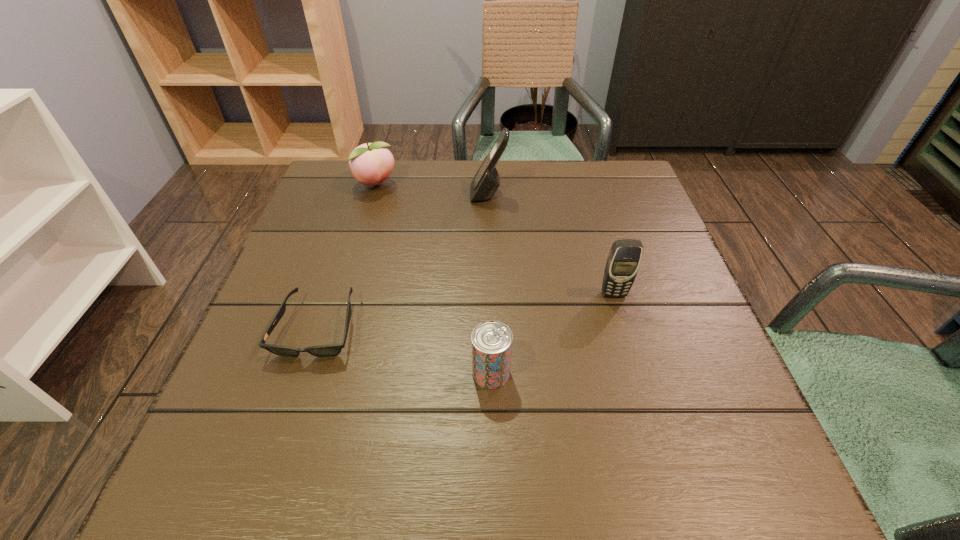
I want to click on unoccupied position between the peach and the left cellular telephone, so click(x=432, y=190).

Locate an element on the screen. vacant space in between the peach and the left cellular telephone is located at coordinates (432, 190).

Identify the location of free spot between the taller cellular telephone and the peach. (432, 190).

Find the location of `free space between the shortest object and the second shortest object`. free space between the shortest object and the second shortest object is located at coordinates (404, 350).

What are the coordinates of `vacant region between the taller cellular telephone and the second shortest object` in the screenshot? It's located at (490, 284).

Identify which object is the second nearest to the beer can. Please provide its 2D coordinates. Your answer should be formatted as a tuple, i.e. [(x, y)], where the tuple contains the x and y coordinates of a point satisfying the conditions above.

[(623, 261)]

Locate which object ranks fourth in proximity to the second shortest object. Please provide its 2D coordinates. Your answer should be formatted as a tuple, i.e. [(x, y)], where the tuple contains the x and y coordinates of a point satisfying the conditions above.

[(371, 163)]